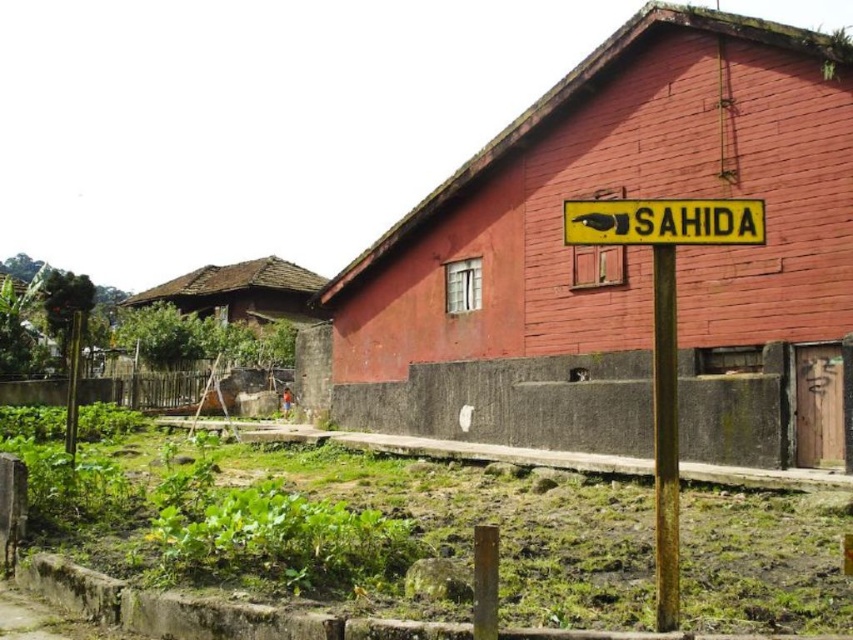
Who is positioned more to the left, yellow metal sign at center or yellow plastic sign at upper center?

From the viewer's perspective, yellow plastic sign at upper center appears more on the left side.

Is yellow metal sign at center behind yellow plastic sign at upper center?

No, it is in front of yellow plastic sign at upper center.

The width and height of the screenshot is (853, 640). In order to click on yellow metal sign at center in this screenshot , I will do `click(664, 328)`.

Who is more forward, (689, 240) or (674, 627)?

Point (674, 627) is more forward.

Between point (683, 230) and point (660, 620), which one is positioned behind?

Positioned behind is point (683, 230).

In order to click on yellow plastic sign at upper center in this screenshot , I will do `click(664, 221)`.

Does smooth red wooden hut at center have a greater width compared to yellow plastic sign at upper center?

Indeed, smooth red wooden hut at center has a greater width compared to yellow plastic sign at upper center.

Is point (570, 412) positioned after point (643, 228)?

Yes, point (570, 412) is behind point (643, 228).

At what (x,y) coordinates should I click in order to perform the action: click on smooth red wooden hut at center. Please return your answer as a coordinate pair (x, y). Looking at the image, I should click on (605, 248).